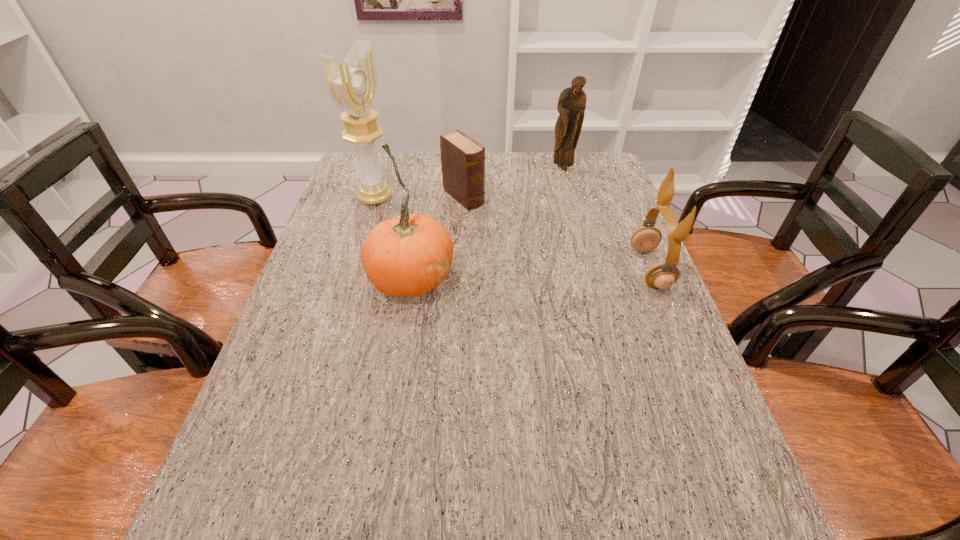
Where is `pumpkin positioned at the left edge`? pumpkin positioned at the left edge is located at coordinates (410, 255).

This screenshot has width=960, height=540. I want to click on award present at the left edge, so click(x=352, y=85).

Where is `earphone located in the right edge section of the desktop`? The height and width of the screenshot is (540, 960). earphone located in the right edge section of the desktop is located at coordinates (663, 275).

Identify the location of figurine present at the right edge. (571, 105).

This screenshot has width=960, height=540. In order to click on object that is positioned at the far left corner in this screenshot , I will do `click(352, 85)`.

You are a GUI agent. You are given a task and a screenshot of the screen. Output one action in this format:
    pyautogui.click(x=<x>, y=<y>)
    Task: Click on the object present at the far right corner
    
    Given the screenshot: What is the action you would take?
    pyautogui.click(x=571, y=105)

You are a GUI agent. You are given a task and a screenshot of the screen. Output one action in this format:
    pyautogui.click(x=<x>, y=<y>)
    Task: Click on the vacant area at the far edge
    This screenshot has height=540, width=960.
    Given the screenshot: What is the action you would take?
    pyautogui.click(x=501, y=171)

Find the location of a particular element. Image resolution: width=960 pixels, height=540 pixels. vacant area at the near edge of the desktop is located at coordinates (630, 437).

The height and width of the screenshot is (540, 960). I want to click on vacant area at the left edge, so click(x=336, y=256).

Where is `vacant space at the right edge of the desktop`? This screenshot has width=960, height=540. vacant space at the right edge of the desktop is located at coordinates (599, 194).